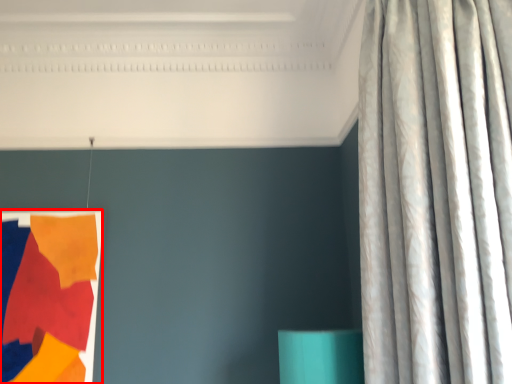
Question: Considering the relative positions of tapestry (annotated by the red box) and curtain in the image provided, where is tapestry (annotated by the red box) located with respect to the staircase?

Choices:
 (A) left
 (B) right

Answer: (A)